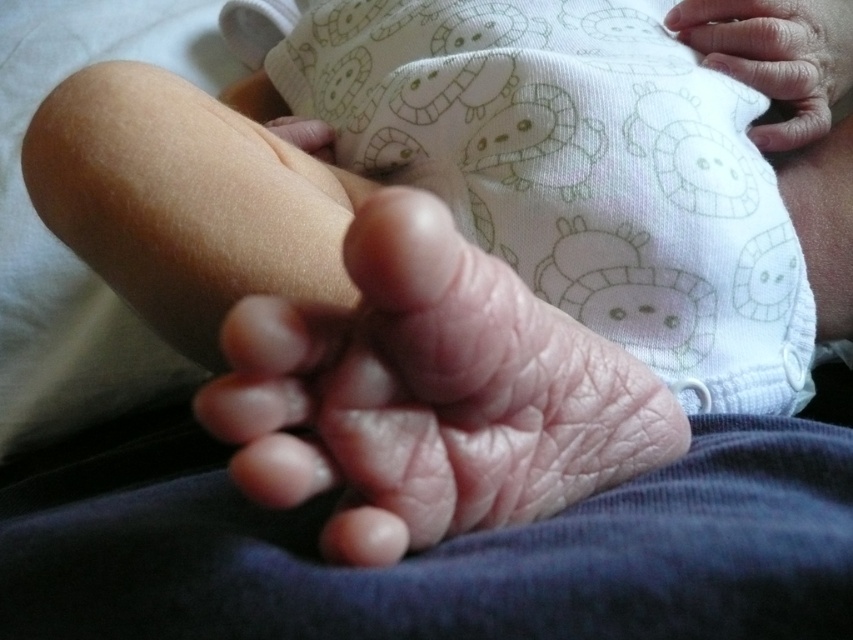
Question: Considering the relative positions of pink skin hand at center and smooth skin hand at upper right in the image provided, where is pink skin hand at center located with respect to smooth skin hand at upper right?

Choices:
 (A) left
 (B) right

Answer: (A)

Question: Among these objects, which one is nearest to the camera?

Choices:
 (A) pink skin hand at center
 (B) smooth skin hand at upper right

Answer: (A)

Question: Is pink skin hand at center wider than smooth skin hand at upper right?

Choices:
 (A) no
 (B) yes

Answer: (B)

Question: Among these points, which one is nearest to the camera?

Choices:
 (A) (340, 381)
 (B) (805, 109)

Answer: (A)

Question: Is pink skin hand at center smaller than smooth skin hand at upper right?

Choices:
 (A) yes
 (B) no

Answer: (B)